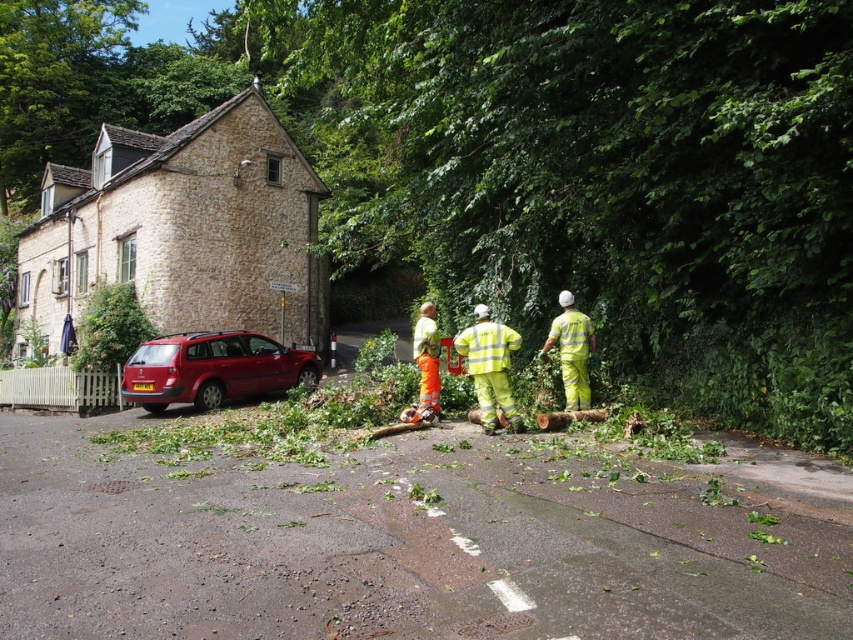
Consider the image. Who is higher up, shiny metallic car at left or yellow reflective pants at center?

Positioned higher is yellow reflective pants at center.

Which is in front, point (172, 396) or point (585, 355)?

Point (585, 355) is more forward.

Identify the location of shiny metallic car at left. (213, 369).

Can you confirm if green leafy tree at center is positioned to the left of yellow reflective uniform at center?

Yes, green leafy tree at center is to the left of yellow reflective uniform at center.

Who is more distant from viewer, (553,252) or (469,332)?

Point (553,252)

The height and width of the screenshot is (640, 853). What do you see at coordinates (532, 163) in the screenshot? I see `green leafy tree at center` at bounding box center [532, 163].

I want to click on green leafy tree at center, so click(x=532, y=163).

You are a GUI agent. You are given a task and a screenshot of the screen. Output one action in this format:
    pyautogui.click(x=<x>, y=<y>)
    Task: Click on the green leafy tree at center
    The width and height of the screenshot is (853, 640).
    Given the screenshot: What is the action you would take?
    pyautogui.click(x=532, y=163)

Is green leafy tree at center thinner than yellow reflective pants at center?

In fact, green leafy tree at center might be wider than yellow reflective pants at center.

Is point (567, 36) positioned in front of point (570, 410)?

Yes.

Find the location of a particular element. Image resolution: width=853 pixels, height=640 pixels. green leafy tree at center is located at coordinates (532, 163).